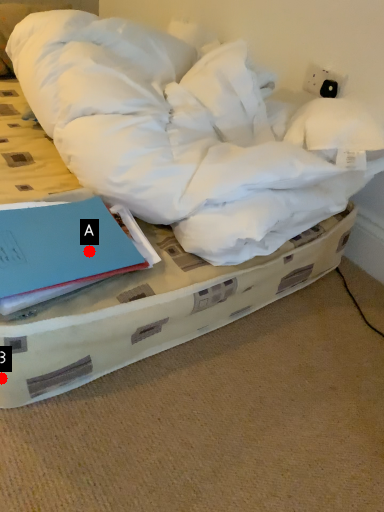
Question: Two points are circled on the image, labeled by A and B beside each circle. Among these points, which one is farthest from the camera?

Choices:
 (A) A is further
 (B) B is further

Answer: (A)